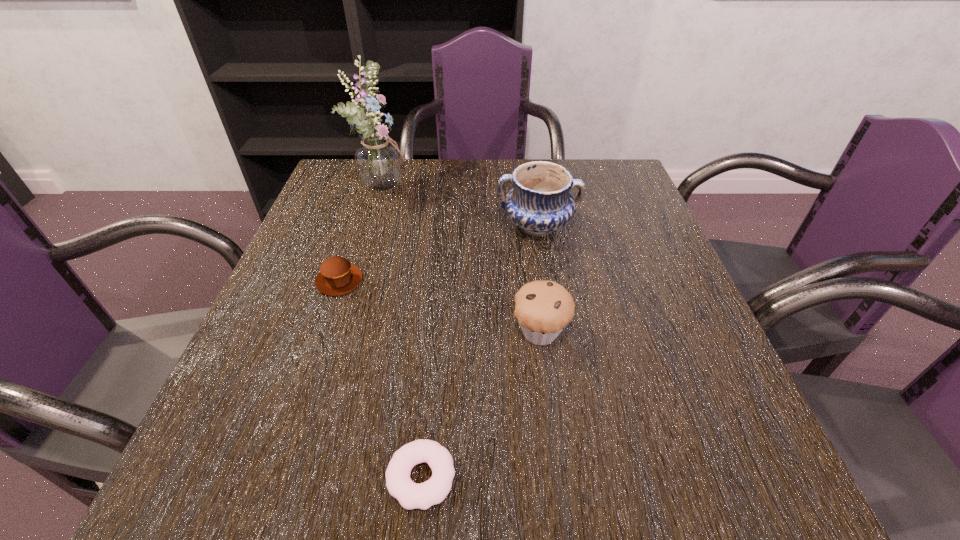
Where is `vacant region between the bouquet and the nearer muffin`? vacant region between the bouquet and the nearer muffin is located at coordinates pos(463,259).

The width and height of the screenshot is (960, 540). What are the coordinates of `vacant area that lies between the tallest object and the nearer muffin` in the screenshot? It's located at (463, 259).

I want to click on empty space that is in between the doughnut and the pottery, so click(x=479, y=352).

This screenshot has width=960, height=540. Identify the location of free spot between the taller muffin and the second shortest object. (440, 306).

You are a GUI agent. You are given a task and a screenshot of the screen. Output one action in this format:
    pyautogui.click(x=<x>, y=<y>)
    Task: Click on the object that is the fourth closest one to the left muffin
    Image resolution: width=960 pixels, height=540 pixels.
    Given the screenshot: What is the action you would take?
    pyautogui.click(x=410, y=495)

You are a GUI agent. You are given a task and a screenshot of the screen. Output one action in this format:
    pyautogui.click(x=<x>, y=<y>)
    Task: Click on the object that ranks as the second closest to the left muffin
    The image size is (960, 540).
    Given the screenshot: What is the action you would take?
    pyautogui.click(x=539, y=203)

Where is `vacant space that satisfies the following two spatial constraints: 1. on the back side of the second tallest object; 2. on the right side of the shorter muffin`? Image resolution: width=960 pixels, height=540 pixels. vacant space that satisfies the following two spatial constraints: 1. on the back side of the second tallest object; 2. on the right side of the shorter muffin is located at coordinates (358, 226).

At what (x,y) coordinates should I click in order to perform the action: click on blank space that satisfies the following two spatial constraints: 1. on the back side of the pottery; 2. on the left side of the third object from left to right. Please return your answer as a coordinate pair (x, y). Looking at the image, I should click on (445, 226).

You are a GUI agent. You are given a task and a screenshot of the screen. Output one action in this format:
    pyautogui.click(x=<x>, y=<y>)
    Task: Click on the free space that satisfies the following two spatial constraints: 1. on the front-facing side of the doughnut; 2. on the left side of the tallest object
    Image resolution: width=960 pixels, height=540 pixels.
    Given the screenshot: What is the action you would take?
    pyautogui.click(x=298, y=477)

This screenshot has height=540, width=960. Identify the location of vacant area in the image that satisfies the following two spatial constraints: 1. on the front-facing side of the second tallest object; 2. on the right side of the tallest object. (372, 226).